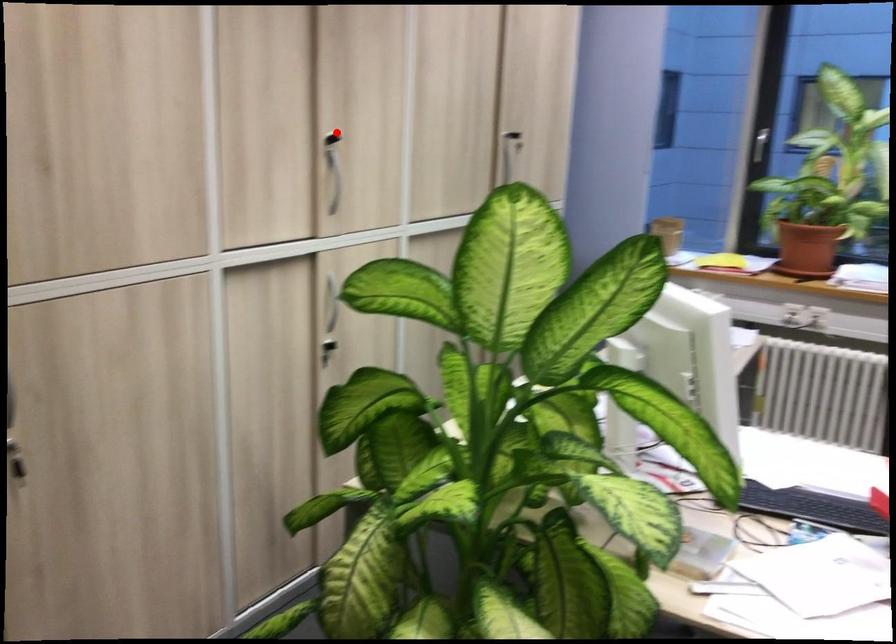
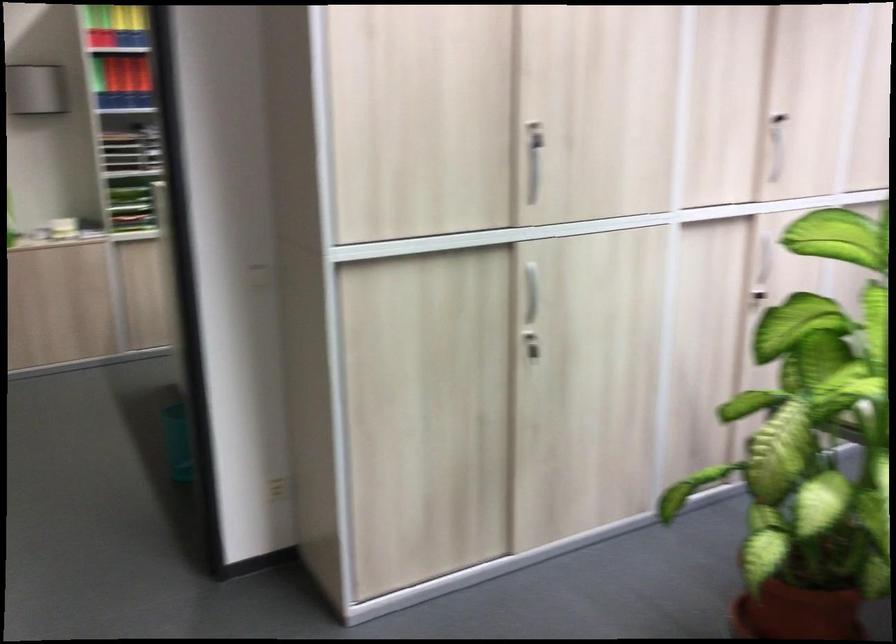
Locate, in the second image, the point that corresponds to the highlighted location in the first image.

(779, 116)